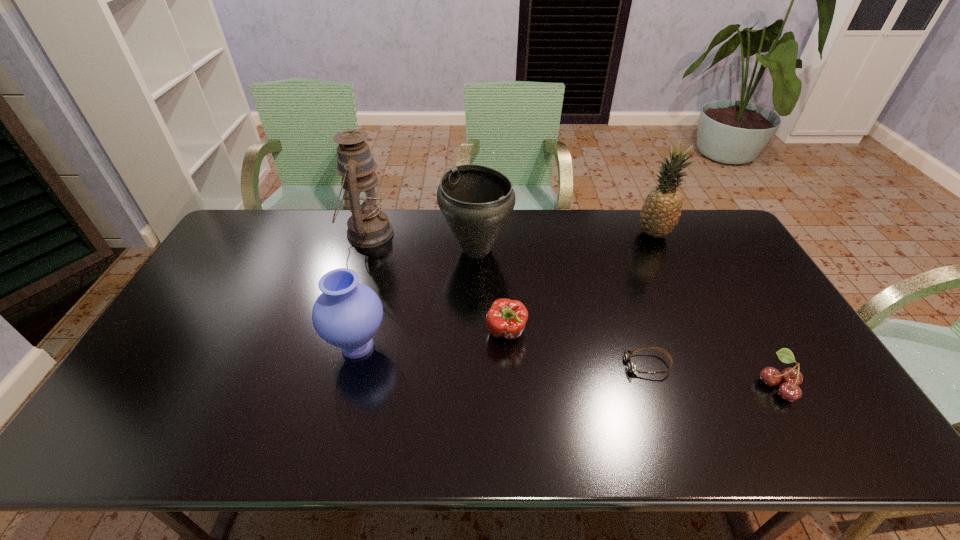
Identify the location of oil lamp positioned at the far edge. (368, 227).

I want to click on pineapple that is positioned at the far edge, so click(660, 213).

Locate an element on the screen. The height and width of the screenshot is (540, 960). urn that is at the far edge is located at coordinates (476, 201).

You are a GUI agent. You are given a task and a screenshot of the screen. Output one action in this format:
    pyautogui.click(x=<x>, y=<y>)
    Task: Click on the object that is at the right edge
    The height and width of the screenshot is (540, 960).
    Given the screenshot: What is the action you would take?
    pyautogui.click(x=791, y=378)

In the image, there is a desktop. Where is `vacant space at the far edge`? vacant space at the far edge is located at coordinates (644, 245).

This screenshot has height=540, width=960. I want to click on vacant space at the near edge of the desktop, so click(x=706, y=451).

The width and height of the screenshot is (960, 540). I want to click on free point at the near left corner, so click(157, 435).

In the image, there is a desktop. In order to click on vacant space at the far right corner in this screenshot , I will do 710,217.

Identify the location of vacant space at the near right corner of the desktop. The width and height of the screenshot is (960, 540). (839, 434).

Identify the location of free spot between the urn and the third object from right to left. click(x=562, y=307).